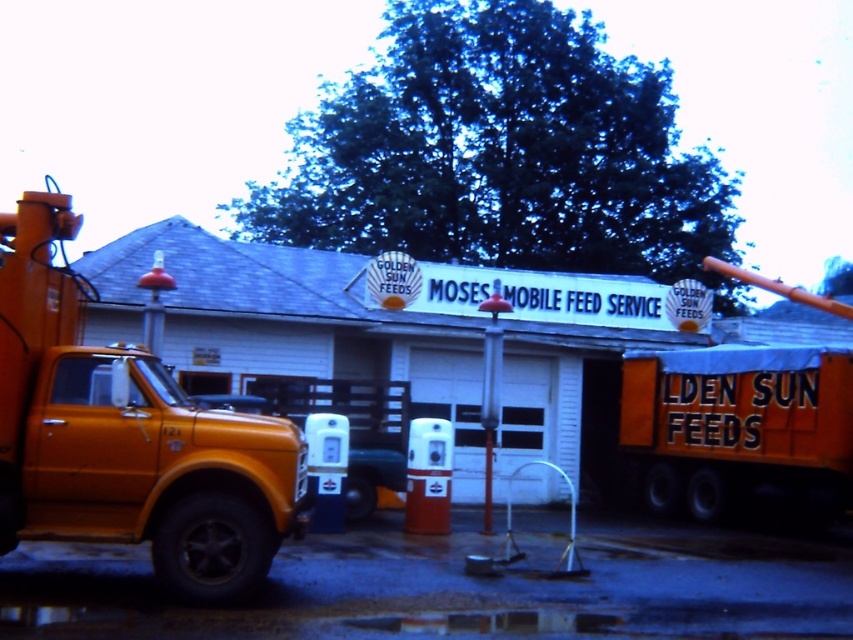
You are a delivery driver who needs to park your truck next to the metallic red pole at center. The orange matte truck at center is already parked there. Can you park your truck without hitting the pole?

The orange matte truck at center is wider than the metallic red pole at center. Since the orange truck is already occupying the space, there might not be enough room for your truck unless it is narrower than the orange truck. However, the description only states the orange truck is wider than the pole, not the available space. Therefore, it is uncertain if your truck can park without hitting the pole based on the given information.

You are standing at the entrance of MOSES MOBILE FEED SERVICE and looking towards the large orange truck parked in front of the building. There is a specific point at coordinates (126, 436). What object is located at this point?

The point at (126, 436) is occupied by the matte orange truck at left.

You are a delivery driver who needs to park your truck in the parking lot behind the MOSES MOBILE FEED SERVICE building. However, there is limited space between the matte orange truck at left and the orange matte truck at center. Can you safely maneuver your truck into the space between them?

The matte orange truck at left is in front of orange matte truck at center, meaning there is no space between them for your truck to park safely. You should look for another parking spot.